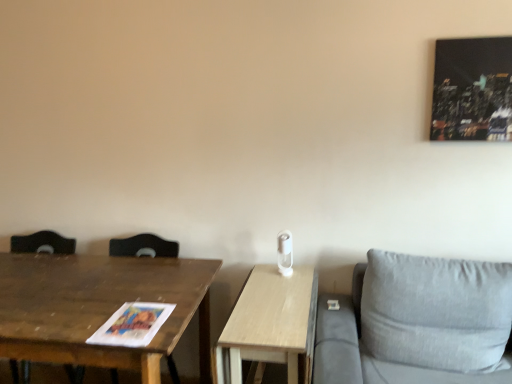
Question: In the image, is wooden table at left, marked as the first table in a left-to-right arrangement, on the left side or the right side of brown wooden swivel chair at left?

Choices:
 (A) left
 (B) right

Answer: (B)

Question: Choose the correct answer: Is wooden table at left, placed as the 2th table when sorted from right to left, inside brown wooden swivel chair at left or outside it?

Choices:
 (A) inside
 (B) outside

Answer: (B)

Question: Which object is positioned closest to the brown wooden swivel chair at left?

Choices:
 (A) wooden table at center, marked as the first table in a right-to-left arrangement
 (B) wooden table at left, marked as the first table in a left-to-right arrangement

Answer: (B)

Question: Estimate the real-world distances between objects in this image. Which object is farther from the wooden table at left, placed as the 2th table when sorted from right to left?

Choices:
 (A) brown wooden swivel chair at left
 (B) wooden table at center, marked as the first table in a right-to-left arrangement

Answer: (A)